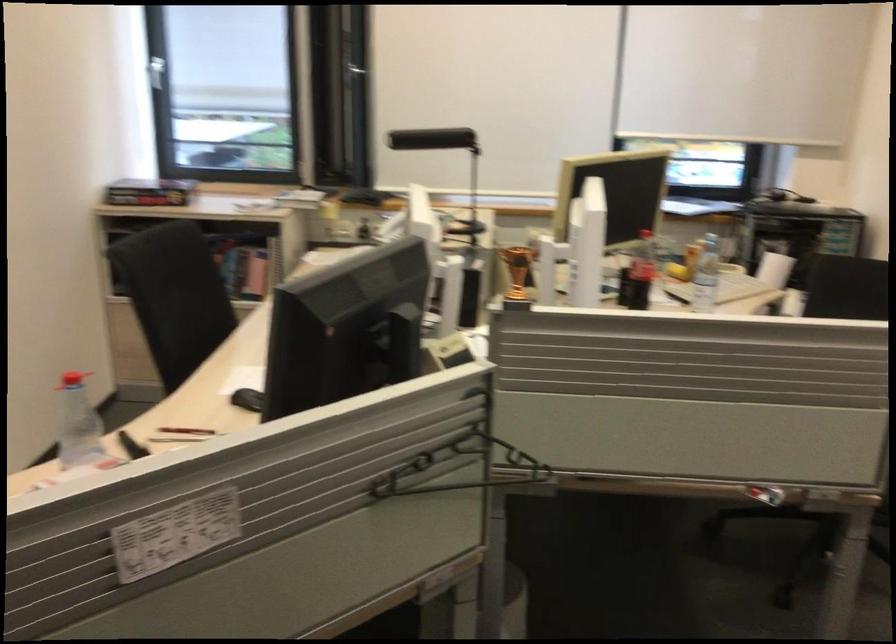
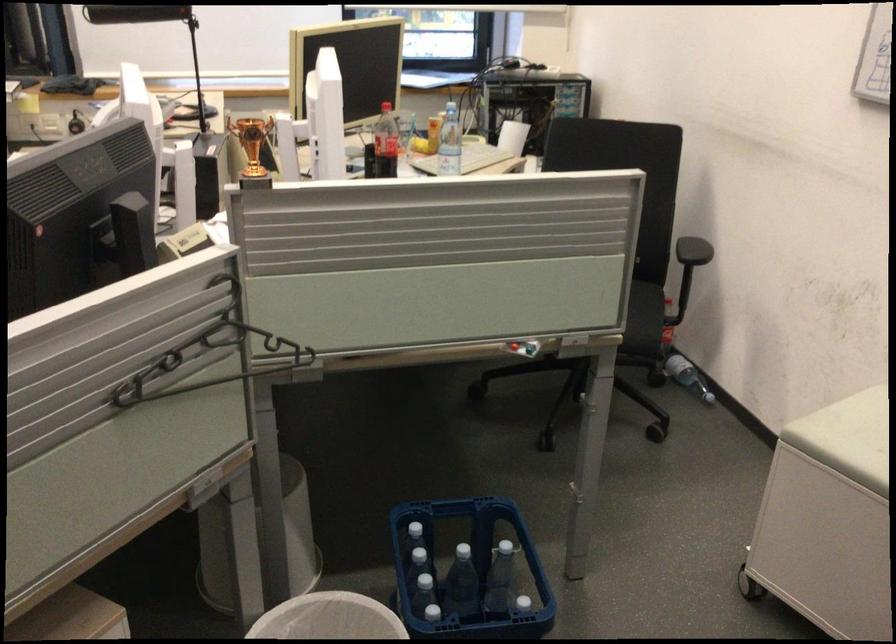
Find the pixel in the second image that matches point (642, 267) in the first image.

(385, 143)